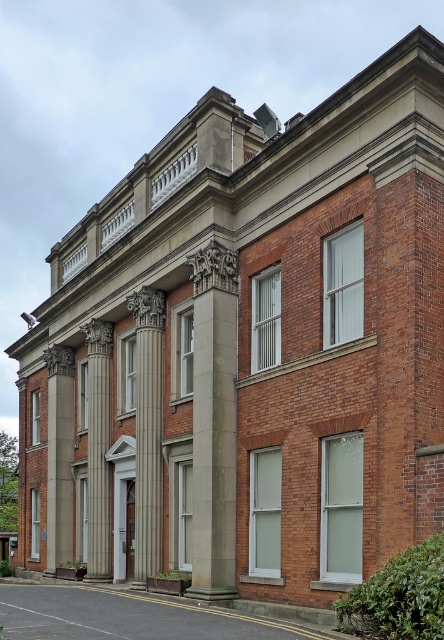
Question: Which point is farther from the camera taking this photo?

Choices:
 (A) (155, 364)
 (B) (90, 452)
 (C) (51, 384)

Answer: (C)

Question: Is white marble column at center bigger than polished stone column at left?

Choices:
 (A) no
 (B) yes

Answer: (B)

Question: Can you confirm if gray stone column at center is positioned below white marble column at center?

Choices:
 (A) yes
 (B) no

Answer: (B)

Question: Which object appears farthest from the camera in this image?

Choices:
 (A) gray stone column at center
 (B) white marble column at center
 (C) smooth stone column at left

Answer: (C)

Question: Which object is closer to the camera taking this photo?

Choices:
 (A) smooth stone column at left
 (B) polished stone column at left
 (C) white marble column at center
 (D) gray stone column at center

Answer: (D)

Question: Is gray stone column at center thinner than smooth stone column at left?

Choices:
 (A) no
 (B) yes

Answer: (B)